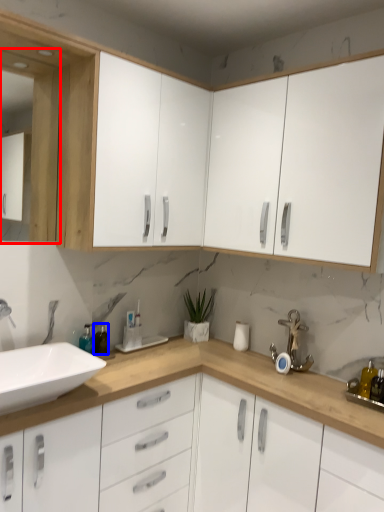
Question: Which object appears closest to the camera in this image, medicine cabinet (highlighted by a red box) or bottle (highlighted by a blue box)?

Choices:
 (A) medicine cabinet
 (B) bottle

Answer: (A)